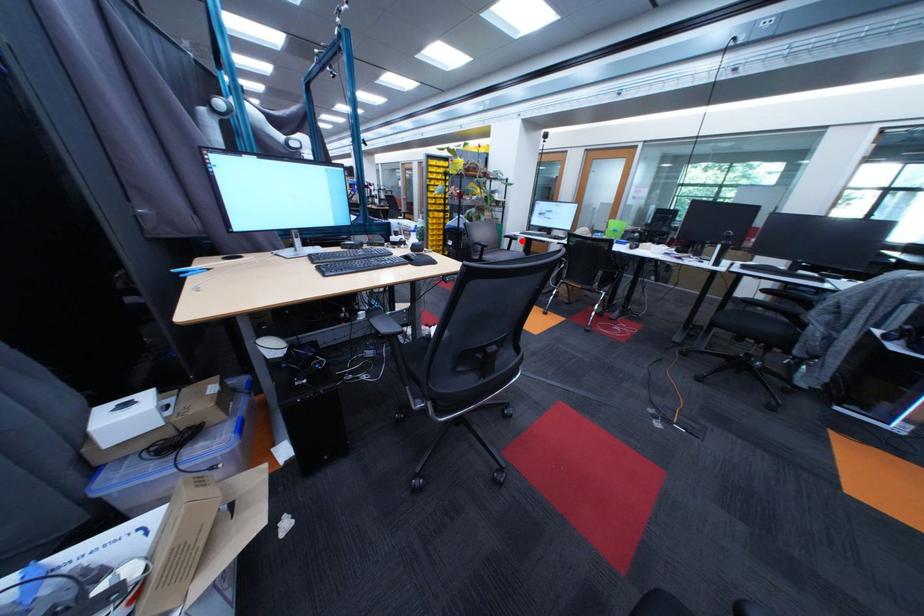
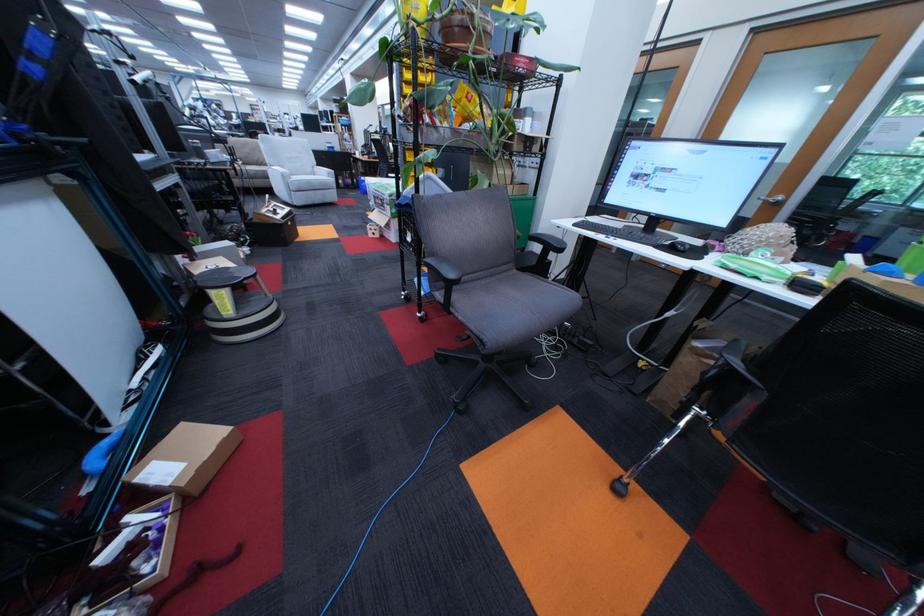
Question: I am providing you with two images of the same scene from different viewpoints. In image1, a red point is highlighted. Considering the same 3D point in image2, which of the following is correct?

Choices:
 (A) It is closer
 (B) It is farther

Answer: (B)